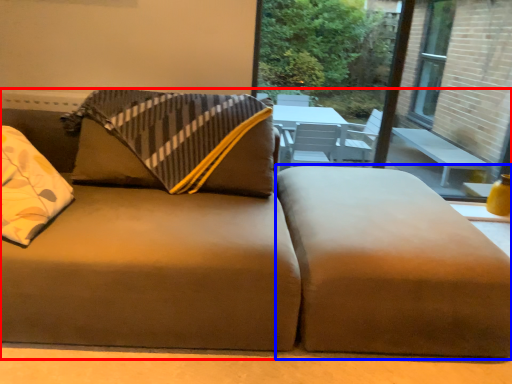
Question: Which object appears closest to the camera in this image, studio couch (highlighted by a red box) or footrest (highlighted by a blue box)?

Choices:
 (A) studio couch
 (B) footrest

Answer: (A)